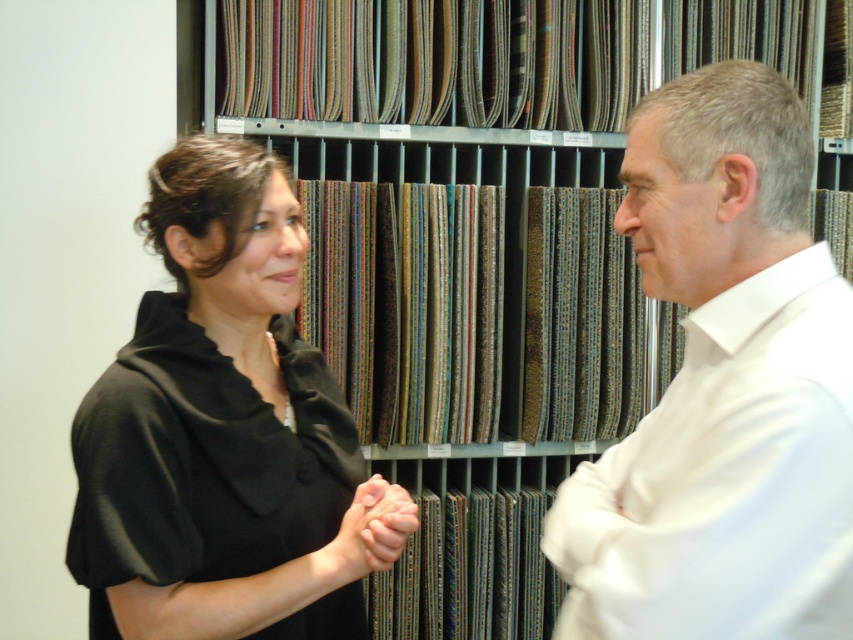
Question: Among these points, which one is farthest from the camera?

Choices:
 (A) (633, 120)
 (B) (286, 492)

Answer: (B)

Question: From the image, what is the correct spatial relationship of black satin blouse at left in relation to smooth skin hands at center?

Choices:
 (A) left
 (B) right

Answer: (A)

Question: From the image, what is the correct spatial relationship of black satin blouse at left in relation to smooth skin hands at center?

Choices:
 (A) above
 (B) below

Answer: (A)

Question: Which object is positioned closest to the smooth skin hands at center?

Choices:
 (A) black satin blouse at left
 (B) white satin shirt at right

Answer: (A)

Question: Is white satin shirt at right behind black satin blouse at left?

Choices:
 (A) yes
 (B) no

Answer: (B)

Question: Based on their relative distances, which object is nearer to the black satin blouse at left?

Choices:
 (A) smooth skin hands at center
 (B) white satin shirt at right

Answer: (A)